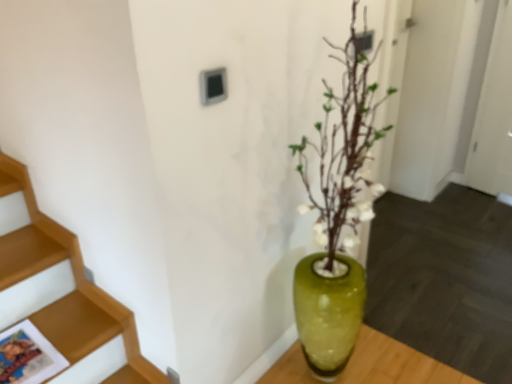
Question: Considering the positions of green glass vase at center and green glass vase at center in the image, is green glass vase at center wider or thinner than green glass vase at center?

Choices:
 (A) thin
 (B) wide

Answer: (A)

Question: Considering the positions of point (297, 274) and point (346, 271), is point (297, 274) closer or farther from the camera than point (346, 271)?

Choices:
 (A) closer
 (B) farther

Answer: (B)

Question: From a real-world perspective, is green glass vase at center above or below green glass vase at center?

Choices:
 (A) below
 (B) above

Answer: (A)

Question: Considering the positions of green glass vase at center and green glass vase at center in the image, is green glass vase at center taller or shorter than green glass vase at center?

Choices:
 (A) short
 (B) tall

Answer: (B)

Question: Considering the positions of green glass vase at center and green glass vase at center in the image, is green glass vase at center bigger or smaller than green glass vase at center?

Choices:
 (A) small
 (B) big

Answer: (B)

Question: From a real-world perspective, is green glass vase at center physically located above or below green glass vase at center?

Choices:
 (A) below
 (B) above

Answer: (B)

Question: In terms of width, does green glass vase at center look wider or thinner when compared to green glass vase at center?

Choices:
 (A) thin
 (B) wide

Answer: (B)